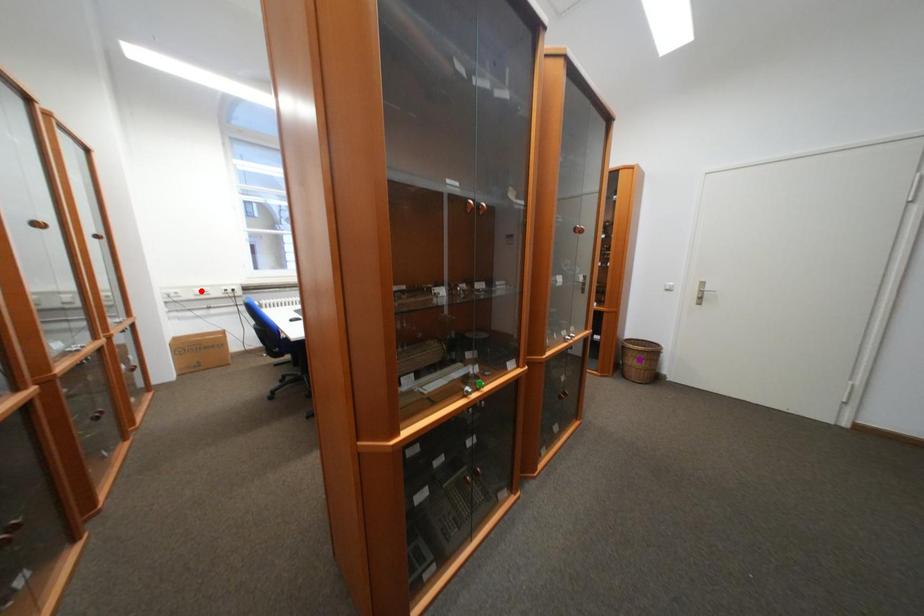
Order these from nearest to farthest:
purple point, red point, green point

green point
purple point
red point